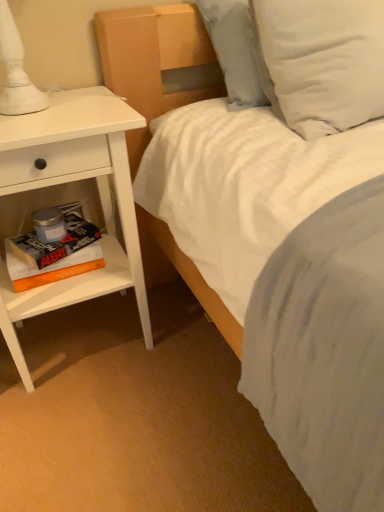
Locate an element on the screen. free location to the right of white matte nightstand at left is located at coordinates (183, 349).